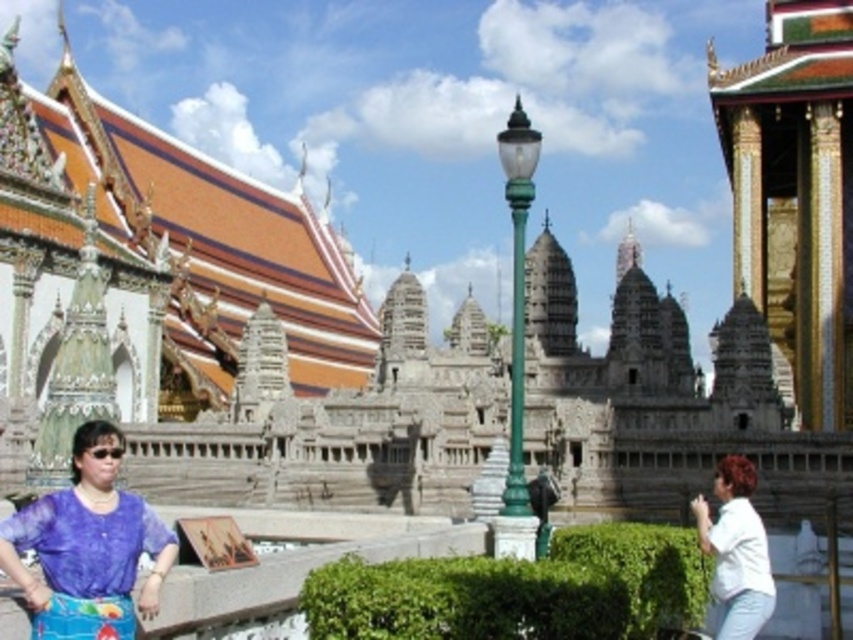
Is point (7, 548) closer to camera compared to point (766, 600)?

Yes, point (7, 548) is closer to viewer.

Between point (125, 442) and point (718, 600), which one is positioned in front?

Point (718, 600) is more forward.

Locate an element on the screen. purple sheer blouse at lower left is located at coordinates (88, 541).